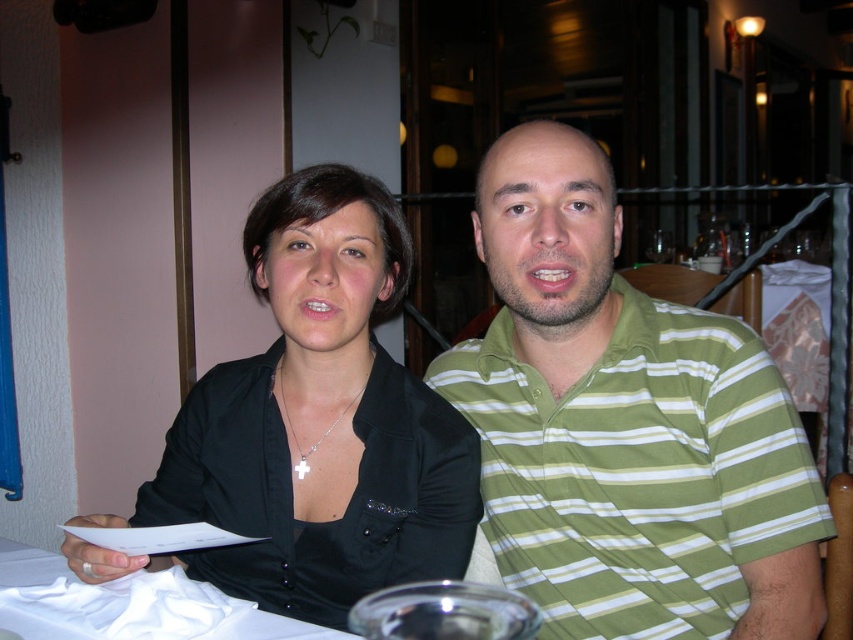
Question: Is green striped polo shirt at center above black matte shirt at center?

Choices:
 (A) no
 (B) yes

Answer: (B)

Question: Considering the relative positions of black matte shirt at center and white cloth at lower left in the image provided, where is black matte shirt at center located with respect to white cloth at lower left?

Choices:
 (A) left
 (B) right

Answer: (B)

Question: Which is farther from the green striped polo shirt at center?

Choices:
 (A) black matte shirt at center
 (B) white cloth at lower left

Answer: (B)

Question: Which object appears closest to the camera in this image?

Choices:
 (A) black matte shirt at center
 (B) white cloth at lower left
 (C) green striped polo shirt at center

Answer: (B)

Question: In this image, where is black matte shirt at center located relative to white cloth at lower left?

Choices:
 (A) below
 (B) above

Answer: (B)

Question: Which point is farther to the camera?

Choices:
 (A) green striped polo shirt at center
 (B) black matte shirt at center
 (C) white cloth at lower left

Answer: (B)